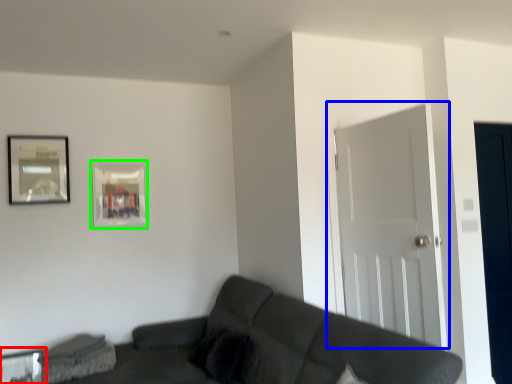
Question: Which object is positioned farthest from glass table (highlighted by a red box)? Select from door (highlighted by a blue box) and picture frame (highlighted by a green box).

Choices:
 (A) door
 (B) picture frame

Answer: (A)